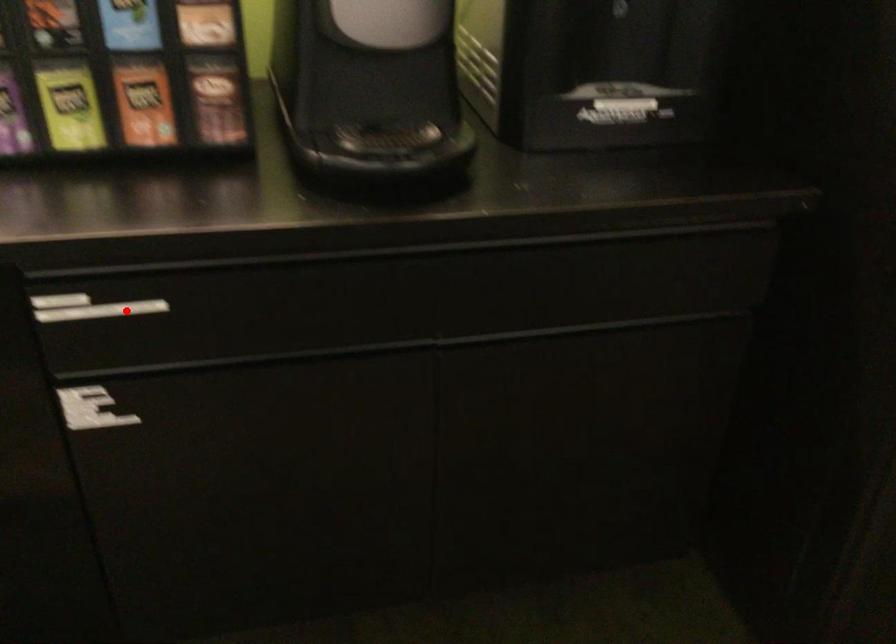
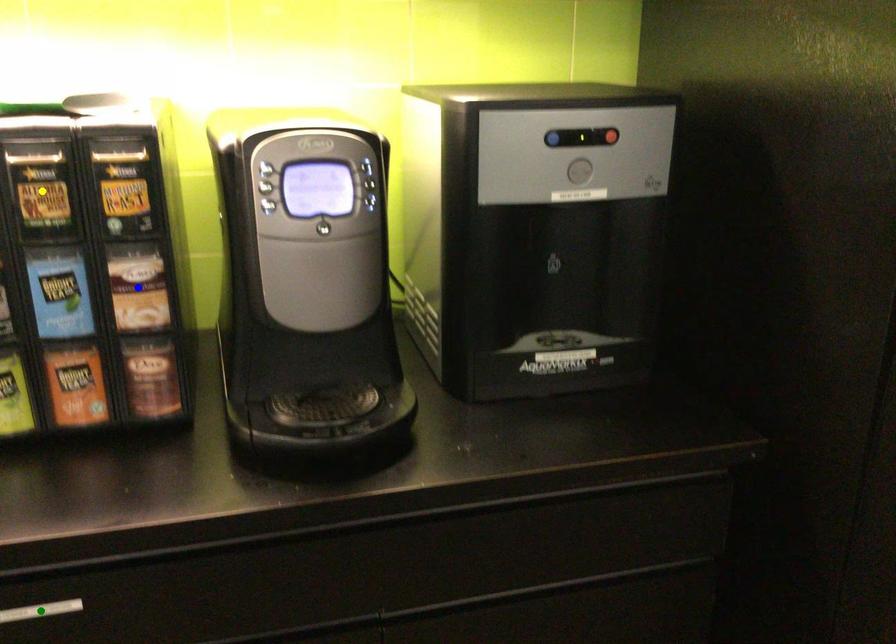
Question: I am providing you with two images of the same scene from different viewpoints. A red point is marked on the first image. You are given multiple points on the second image. Which point in image 2 is actually the same real-world point as the red point in image 1?

Choices:
 (A) blue point
 (B) yellow point
 (C) green point

Answer: (C)